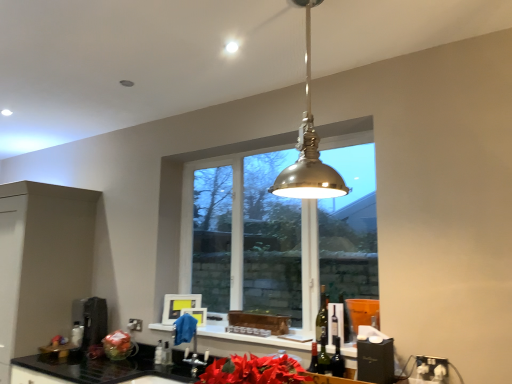
Question: Is matte black cabinet at left taller or shorter than clear glass bottle at lower center, which is counted as the 2th bottle, starting from the left?

Choices:
 (A) short
 (B) tall

Answer: (B)

Question: From a real-world perspective, is matte black cabinet at left positioned above or below clear glass bottle at lower center, which is counted as the 2th bottle, starting from the left?

Choices:
 (A) above
 (B) below

Answer: (A)

Question: Considering the real-world distances, which object is farthest from the green glass bottle at center?

Choices:
 (A) polished brass pendant light at center
 (B) matte black cabinet at left
 (C) black granite countertop at lower left
 (D) clear glass window at center
 (E) metallic stainless steel coffee machine at lower left

Answer: (B)

Question: Estimate the real-world distances between objects in this image. Which object is closer to the clear glass bottle at lower center, marked as the second bottle in a right-to-left arrangement?

Choices:
 (A) matte black cabinet at left
 (B) clear glass window at center
 (C) translucent glass wine bottle at center
 (D) white glossy window sill at center
 (E) black granite countertop at lower left

Answer: (E)